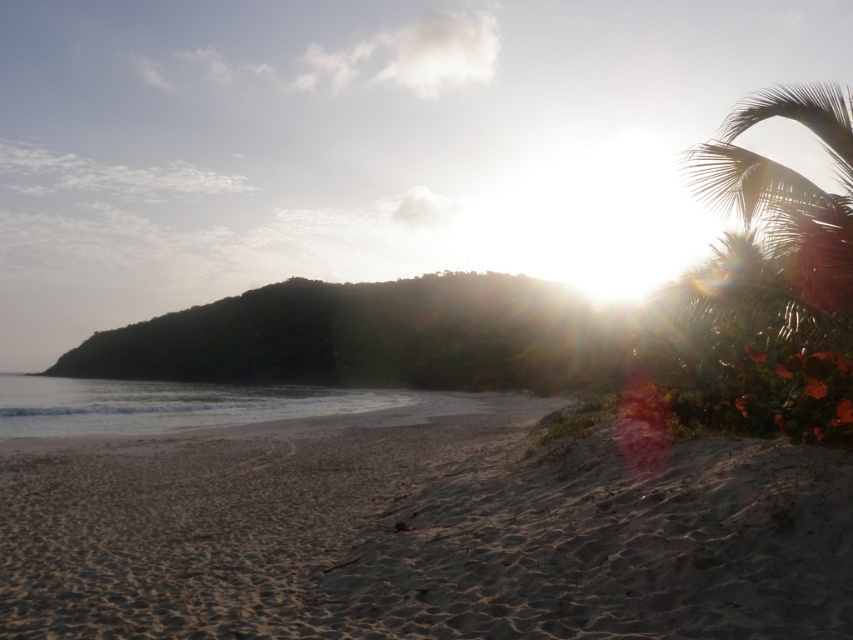
You are a hiker who wants to reach the green leafy palm tree at upper right from your current position on the sandy beach at lower left. What is the approximate distance you need to cover?

The distance between the sandy beach at lower left and the green leafy palm tree at upper right is approximately 24.28 meters, so you need to cover around 24.28 meters to reach the palm tree.

You are standing at the center of the image and want to walk to the sandy beach at lower left. In which direction should you move relative to your current position?

You should move towards the lower left direction to reach the sandy beach at lower left since its 2D location is at point (399,522).